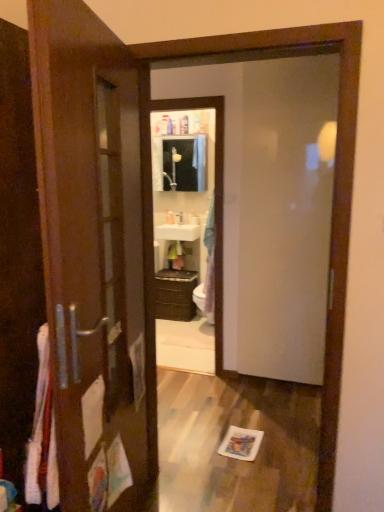
Question: From the image's perspective, does brown matte cabinet at center appear lower than white glossy sink at center?

Choices:
 (A) yes
 (B) no

Answer: (A)

Question: Is brown matte cabinet at center closer to the viewer compared to white glossy sink at center?

Choices:
 (A) no
 (B) yes

Answer: (B)

Question: Is brown matte cabinet at center aimed at white glossy sink at center?

Choices:
 (A) yes
 (B) no

Answer: (B)

Question: From a real-world perspective, is brown matte cabinet at center on white glossy sink at center?

Choices:
 (A) yes
 (B) no

Answer: (B)

Question: Can you confirm if brown matte cabinet at center is wider than white glossy sink at center?

Choices:
 (A) no
 (B) yes

Answer: (B)

Question: Considering the relative sizes of brown matte cabinet at center and white glossy sink at center in the image provided, is brown matte cabinet at center shorter than white glossy sink at center?

Choices:
 (A) no
 (B) yes

Answer: (A)

Question: Does white glossy soap dispenser at center have a lesser height compared to transparent glass door at center?

Choices:
 (A) yes
 (B) no

Answer: (A)

Question: Is the depth of white glossy soap dispenser at center less than that of transparent glass door at center?

Choices:
 (A) yes
 (B) no

Answer: (B)

Question: Considering the relative sizes of white glossy soap dispenser at center and transparent glass door at center in the image provided, is white glossy soap dispenser at center wider than transparent glass door at center?

Choices:
 (A) yes
 (B) no

Answer: (A)

Question: From a real-world perspective, is white glossy soap dispenser at center beneath transparent glass door at center?

Choices:
 (A) no
 (B) yes

Answer: (B)

Question: From a real-world perspective, is white glossy soap dispenser at center over transparent glass door at center?

Choices:
 (A) yes
 (B) no

Answer: (B)

Question: Is the depth of white glossy soap dispenser at center greater than that of transparent glass door at center?

Choices:
 (A) no
 (B) yes

Answer: (B)

Question: Are white glossy sink at center and matte white medicine cabinet at center beside each other?

Choices:
 (A) no
 (B) yes

Answer: (A)